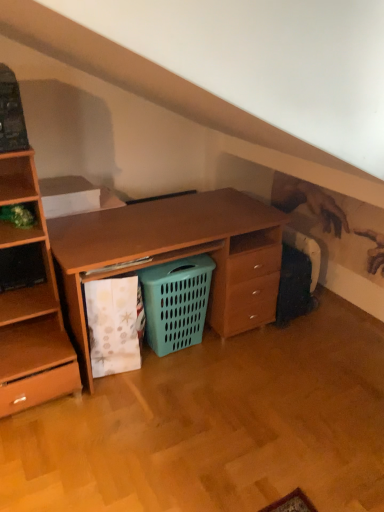
Question: Considering the relative positions of teal plastic laundry basket at center and green matte plant at left in the image provided, is teal plastic laundry basket at center in front of green matte plant at left?

Choices:
 (A) yes
 (B) no

Answer: (B)

Question: From a real-world perspective, is teal plastic laundry basket at center beneath green matte plant at left?

Choices:
 (A) no
 (B) yes

Answer: (B)

Question: Considering the relative sizes of teal plastic laundry basket at center and green matte plant at left in the image provided, is teal plastic laundry basket at center bigger than green matte plant at left?

Choices:
 (A) no
 (B) yes

Answer: (B)

Question: Is green matte plant at left at the back of teal plastic laundry basket at center?

Choices:
 (A) yes
 (B) no

Answer: (B)

Question: Considering the relative sizes of teal plastic laundry basket at center and green matte plant at left in the image provided, is teal plastic laundry basket at center smaller than green matte plant at left?

Choices:
 (A) no
 (B) yes

Answer: (A)

Question: From the image's perspective, is teal plastic laundry basket at center on top of green matte plant at left?

Choices:
 (A) yes
 (B) no

Answer: (B)

Question: Considering the relative sizes of green matte plant at left and teal plastic laundry basket at center in the image provided, is green matte plant at left taller than teal plastic laundry basket at center?

Choices:
 (A) yes
 (B) no

Answer: (B)

Question: Is green matte plant at left next to teal plastic laundry basket at center?

Choices:
 (A) yes
 (B) no

Answer: (B)

Question: Is teal plastic laundry basket at center at the back of green matte plant at left?

Choices:
 (A) yes
 (B) no

Answer: (B)

Question: Is green matte plant at left to the right of teal plastic laundry basket at center from the viewer's perspective?

Choices:
 (A) no
 (B) yes

Answer: (A)

Question: Can you confirm if green matte plant at left is bigger than teal plastic laundry basket at center?

Choices:
 (A) no
 (B) yes

Answer: (A)

Question: From a real-world perspective, does green matte plant at left sit lower than teal plastic laundry basket at center?

Choices:
 (A) yes
 (B) no

Answer: (B)

Question: Looking at their shapes, would you say teal plastic laundry basket at center is wider or thinner than green matte plant at left?

Choices:
 (A) thin
 (B) wide

Answer: (A)